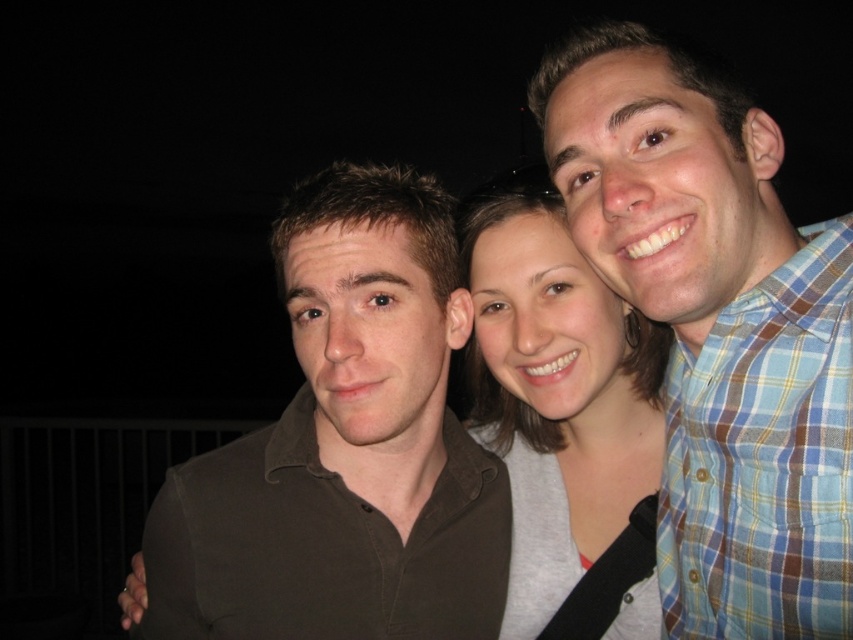
Is dark brown cotton shirt at center bigger than matte gray shirt at center?

Indeed, dark brown cotton shirt at center has a larger size compared to matte gray shirt at center.

Between point (346, 232) and point (550, 362), which one is positioned behind?

Point (550, 362)

Measure the distance between dark brown cotton shirt at center and camera.

dark brown cotton shirt at center is 90.59 centimeters away from camera.

The image size is (853, 640). I want to click on dark brown cotton shirt at center, so click(x=346, y=448).

Is blue plaid shirt at right thinner than dark brown cotton shirt at center?

Yes.

Between point (735, 253) and point (302, 508), which one is positioned behind?

The point (302, 508) is more distant.

At what (x,y) coordinates should I click in order to perform the action: click on blue plaid shirt at right. Please return your answer as a coordinate pair (x, y). This screenshot has width=853, height=640. Looking at the image, I should click on (717, 328).

From the picture: Is blue plaid shirt at right to the right of matte gray shirt at center from the viewer's perspective?

Correct, you'll find blue plaid shirt at right to the right of matte gray shirt at center.

From the picture: Does blue plaid shirt at right appear on the left side of matte gray shirt at center?

In fact, blue plaid shirt at right is to the right of matte gray shirt at center.

Find the location of `blue plaid shirt at right`. blue plaid shirt at right is located at coordinates (717, 328).

Identify the location of blue plaid shirt at right. (717, 328).